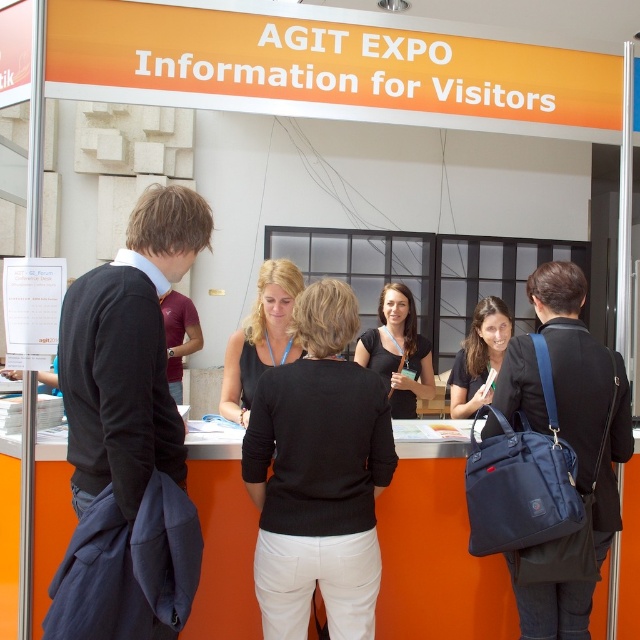
Is black matte shirt at center taller than maroon jersey at center?

In fact, black matte shirt at center may be shorter than maroon jersey at center.

Is black matte shirt at center bigger than maroon jersey at center?

No, black matte shirt at center is not bigger than maroon jersey at center.

Who is more distant from viewer, (x=404, y=380) or (x=180, y=364)?

Positioned behind is point (x=180, y=364).

The width and height of the screenshot is (640, 640). What are the coordinates of `black matte shirt at center` in the screenshot? It's located at (397, 352).

Which is above, black matte sweater at center or maroon jersey at center?

maroon jersey at center is higher up.

Is black matte sweater at center wider than maroon jersey at center?

Correct, the width of black matte sweater at center exceeds that of maroon jersey at center.

Between point (285, 488) and point (166, 292), which one is positioned in front?

Point (285, 488)

What are the coordinates of `black matte sweater at center` in the screenshot? It's located at (317, 476).

Between black fabric jacket at left and matte black bag at right, which one appears on the right side from the viewer's perspective?

From the viewer's perspective, matte black bag at right appears more on the right side.

Is point (88, 634) positioned in front of point (541, 611)?

Yes, point (88, 634) is in front of point (541, 611).

I want to click on black fabric jacket at left, so click(128, 436).